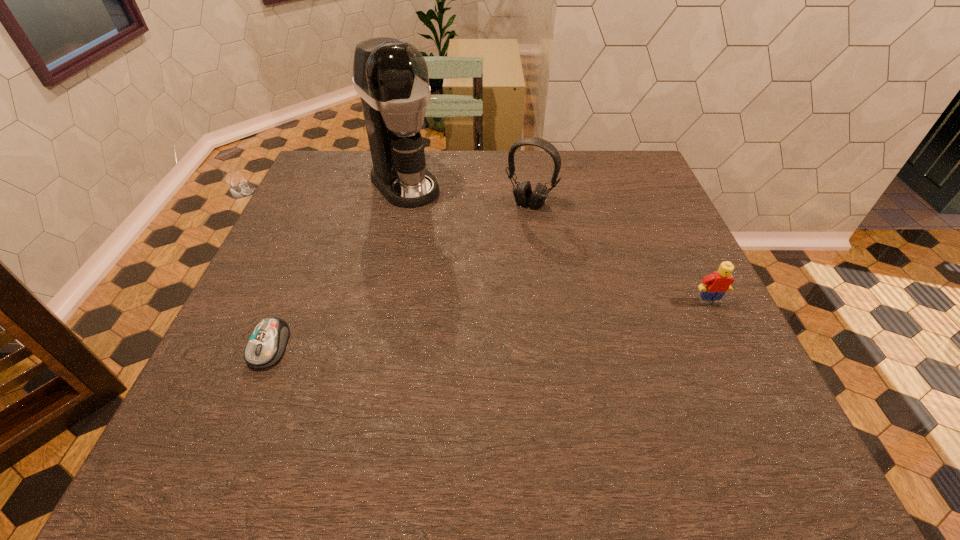
In order to click on free space between the third object from right to left and the third shortest object in this screenshot , I will do `click(468, 194)`.

Find the location of a particular element. The image size is (960, 540). free point between the tallest object and the headset is located at coordinates (468, 194).

Locate an element on the screen. vacant space in between the second object from right to left and the third tallest object is located at coordinates (619, 252).

Where is `empty location between the coffee maker and the leftmost object`? The height and width of the screenshot is (540, 960). empty location between the coffee maker and the leftmost object is located at coordinates (x=337, y=265).

Find the location of a particular element. This screenshot has height=540, width=960. vacant area that lies between the second tallest object and the Lego is located at coordinates (619, 252).

Identify the location of vacant space that is in between the second object from left to right and the nearest object. (337, 265).

In order to click on vacant space that is in between the rightmost object and the second tallest object in this screenshot , I will do `click(619, 252)`.

Identify the location of the closest object to the nearest object. The height and width of the screenshot is (540, 960). (391, 77).

Select which object appears as the closest to the second object from left to right. Please provide its 2D coordinates. Your answer should be formatted as a tuple, i.e. [(x, y)], where the tuple contains the x and y coordinates of a point satisfying the conditions above.

[(523, 194)]

You are a GUI agent. You are given a task and a screenshot of the screen. Output one action in this format:
    pyautogui.click(x=<x>, y=<y>)
    Task: Click on the vacant space that satisfies the following two spatial constraints: 1. on the front side of the third object from right to left; 2. on the left side of the headset
    The width and height of the screenshot is (960, 540).
    Given the screenshot: What is the action you would take?
    pyautogui.click(x=400, y=204)